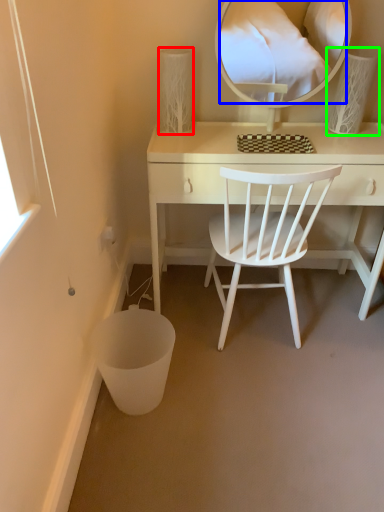
Question: Considering the real-world distances, which object is closest to table lamp (highlighted by a red box)? mirror (highlighted by a blue box) or table lamp (highlighted by a green box).

Choices:
 (A) mirror
 (B) table lamp

Answer: (B)